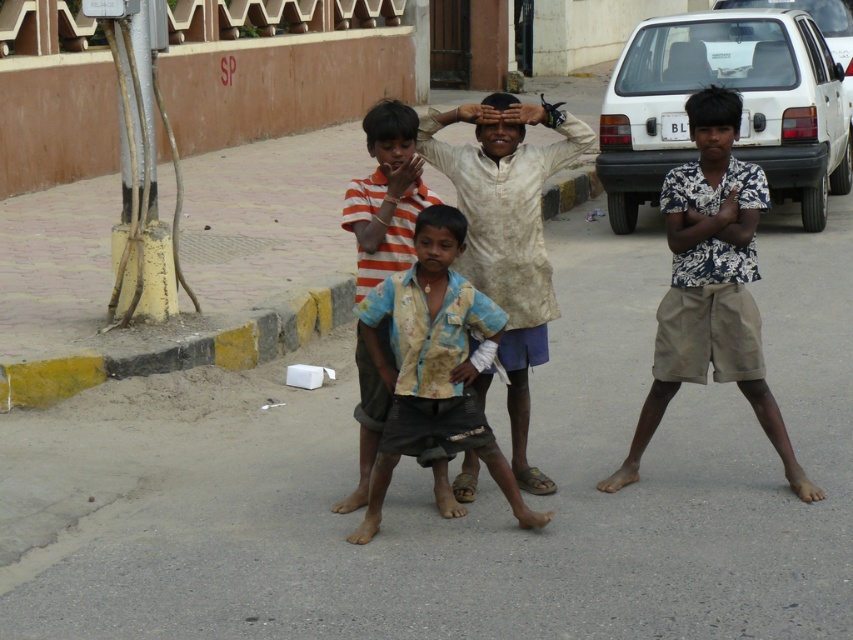
Which is above, printed cotton shirt at center or light beige fabric shirt at center?

printed cotton shirt at center is higher up.

Which is in front, point (705, 221) or point (468, 180)?

Point (705, 221)

The height and width of the screenshot is (640, 853). I want to click on printed cotton shirt at center, so click(711, 285).

Is light beige fabric shirt at center closer to camera compared to white matte car at upper right?

Yes, it is in front of white matte car at upper right.

Is point (489, 236) farther from camera compared to point (828, 4)?

No, (489, 236) is in front of (828, 4).

In order to click on light beige fabric shirt at center in this screenshot , I will do `click(508, 234)`.

Which is behind, point (704, 83) or point (427, 369)?

The point (704, 83) is more distant.

In the scene shown: Is white matte car at right above rusty fabric shirt at center?

Correct, white matte car at right is located above rusty fabric shirt at center.

Describe the element at coordinates (744, 108) in the screenshot. The image size is (853, 640). I see `white matte car at right` at that location.

Find the location of a particular element. white matte car at right is located at coordinates (744, 108).